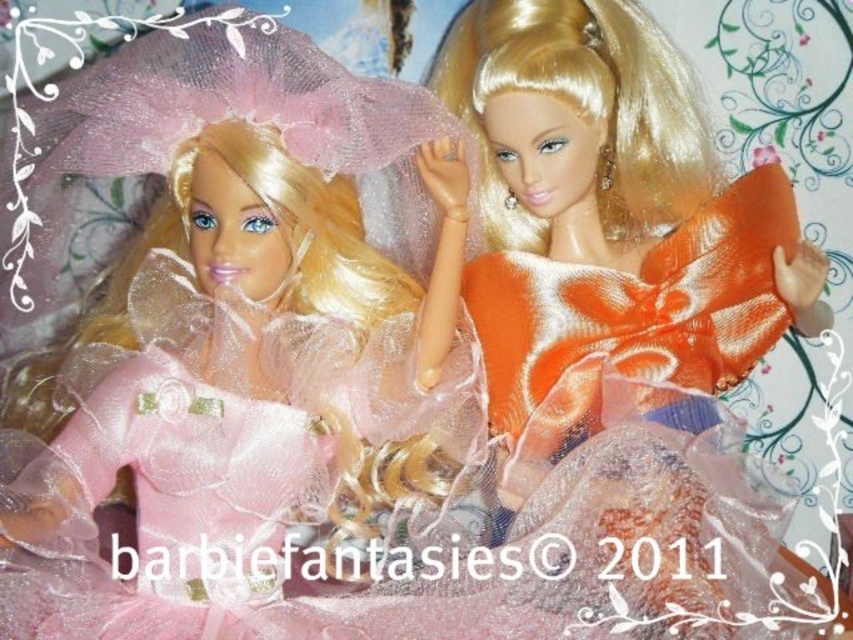
Question: Is matte pink tulle dress at left below orange satin dress at upper right?

Choices:
 (A) no
 (B) yes

Answer: (B)

Question: Is matte pink tulle dress at left to the right of orange satin dress at upper right from the viewer's perspective?

Choices:
 (A) yes
 (B) no

Answer: (B)

Question: Which object is closer to the camera taking this photo?

Choices:
 (A) matte pink tulle dress at left
 (B) orange satin dress at upper right

Answer: (A)

Question: Does matte pink tulle dress at left appear under orange satin dress at upper right?

Choices:
 (A) yes
 (B) no

Answer: (A)

Question: Which point is closer to the camera taking this photo?

Choices:
 (A) (440, 636)
 (B) (703, 180)

Answer: (A)

Question: Among these points, which one is farthest from the camera?

Choices:
 (A) (548, 204)
 (B) (38, 621)

Answer: (A)